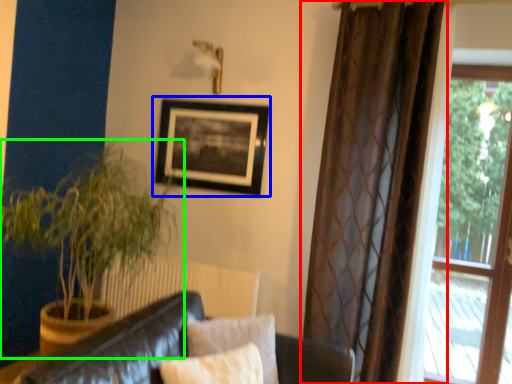
Question: Which is farther away from curtain (highlighted by a red box)? picture frame (highlighted by a blue box) or houseplant (highlighted by a green box)?

Choices:
 (A) picture frame
 (B) houseplant

Answer: (B)